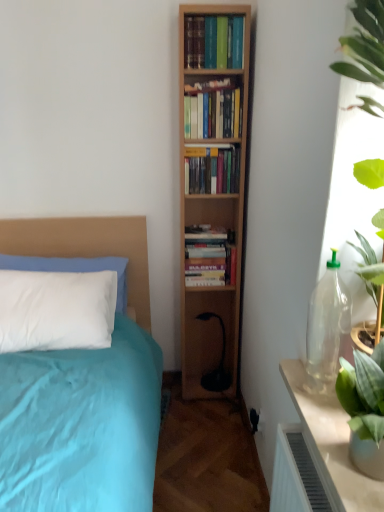
Identify the location of free space below wooden bookshelf at center, which appears as the 3th book when viewed from the top (from a real-world perspective). Image resolution: width=384 pixels, height=512 pixels. (208, 231).